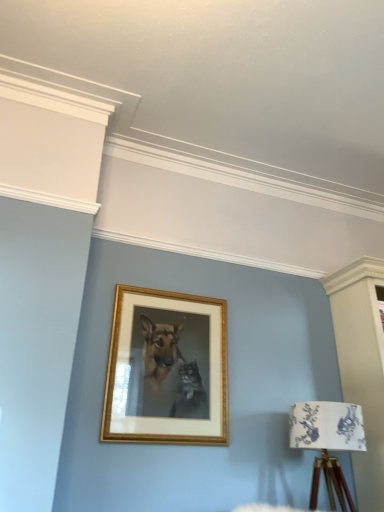
Consider the image. What is the approximate height of white floral fabric at lower right?

It is 20.25 inches.

What do you see at coordinates (327, 442) in the screenshot? I see `white floral fabric at lower right` at bounding box center [327, 442].

Locate an element on the screen. white floral fabric at lower right is located at coordinates (327, 442).

What are the coordinates of `gold wooden picture frame at center` in the screenshot? It's located at (166, 369).

Describe the element at coordinates (166, 369) in the screenshot. I see `gold wooden picture frame at center` at that location.

The image size is (384, 512). Find the location of `white floral fabric at lower right`. white floral fabric at lower right is located at coordinates (327, 442).

Which object is positioned more to the right, gold wooden picture frame at center or white floral fabric at lower right?

Positioned to the right is white floral fabric at lower right.

Considering the relative positions of gold wooden picture frame at center and white floral fabric at lower right in the image provided, is gold wooden picture frame at center behind white floral fabric at lower right?

Yes, it is behind white floral fabric at lower right.

Which point is more distant from viewer, (138, 339) or (303, 445)?

The point (138, 339) is behind.

Looking at this image, from the image's perspective, is gold wooden picture frame at center above or below white floral fabric at lower right?

gold wooden picture frame at center is situated higher than white floral fabric at lower right in the image.

From a real-world perspective, is gold wooden picture frame at center positioned above or below white floral fabric at lower right?

Clearly, from a real-world perspective, gold wooden picture frame at center is above white floral fabric at lower right.

Does gold wooden picture frame at center have a lesser width compared to white floral fabric at lower right?

Answer: Yes, gold wooden picture frame at center is thinner than white floral fabric at lower right.

Can you confirm if gold wooden picture frame at center is taller than white floral fabric at lower right?

Indeed, gold wooden picture frame at center has a greater height compared to white floral fabric at lower right.

Can you confirm if gold wooden picture frame at center is smaller than white floral fabric at lower right?

Yes.

Is gold wooden picture frame at center not within white floral fabric at lower right?

Yes, gold wooden picture frame at center is outside of white floral fabric at lower right.

Is gold wooden picture frame at center beside white floral fabric at lower right?

gold wooden picture frame at center is not next to white floral fabric at lower right, and they're not touching.

Is gold wooden picture frame at center positioned with its back to white floral fabric at lower right?

A: No, gold wooden picture frame at center is not facing the opposite direction of white floral fabric at lower right.

Can you tell me how much gold wooden picture frame at center and white floral fabric at lower right differ in facing direction?

The angle between the facing direction of gold wooden picture frame at center and the facing direction of white floral fabric at lower right is 0.315 degrees.

The width and height of the screenshot is (384, 512). Identify the location of table lamp in front of the gold wooden picture frame at center. (327, 442).

Is white floral fabric at lower right at the left side of gold wooden picture frame at center?

No, white floral fabric at lower right is not to the left of gold wooden picture frame at center.

Between white floral fabric at lower right and gold wooden picture frame at center, which one is positioned in front?

Positioned in front is white floral fabric at lower right.

Is point (316, 493) less distant than point (210, 356)?

Yes.

From the image's perspective, would you say white floral fabric at lower right is positioned over gold wooden picture frame at center?

No, from the image's perspective, white floral fabric at lower right is not on top of gold wooden picture frame at center.

From a real-world perspective, which is physically below, white floral fabric at lower right or gold wooden picture frame at center?

In real-world perspective, white floral fabric at lower right is lower.

In terms of width, does white floral fabric at lower right look wider or thinner when compared to gold wooden picture frame at center?

Clearly, white floral fabric at lower right has more width compared to gold wooden picture frame at center.

Who is taller, white floral fabric at lower right or gold wooden picture frame at center?

With more height is gold wooden picture frame at center.

Can you confirm if white floral fabric at lower right is smaller than gold wooden picture frame at center?

Actually, white floral fabric at lower right might be larger than gold wooden picture frame at center.

Would you say white floral fabric at lower right is outside gold wooden picture frame at center?

white floral fabric at lower right lies outside gold wooden picture frame at center's area.

Does white floral fabric at lower right touch gold wooden picture frame at center?

white floral fabric at lower right and gold wooden picture frame at center are not in contact.

Is white floral fabric at lower right turned away from gold wooden picture frame at center?

No, gold wooden picture frame at center is not at the back of white floral fabric at lower right.

How different are the orientations of white floral fabric at lower right and gold wooden picture frame at center in degrees?

The angular difference between white floral fabric at lower right and gold wooden picture frame at center is 0.315 degrees.

The image size is (384, 512). I want to click on picture frame behind the white floral fabric at lower right, so click(x=166, y=369).

Locate an element on the screen. The image size is (384, 512). picture frame above the white floral fabric at lower right (from the image's perspective) is located at coordinates (166, 369).

At what (x,y) coordinates should I click in order to perform the action: click on picture frame above the white floral fabric at lower right (from a real-world perspective). Please return your answer as a coordinate pair (x, y). Looking at the image, I should click on (166, 369).